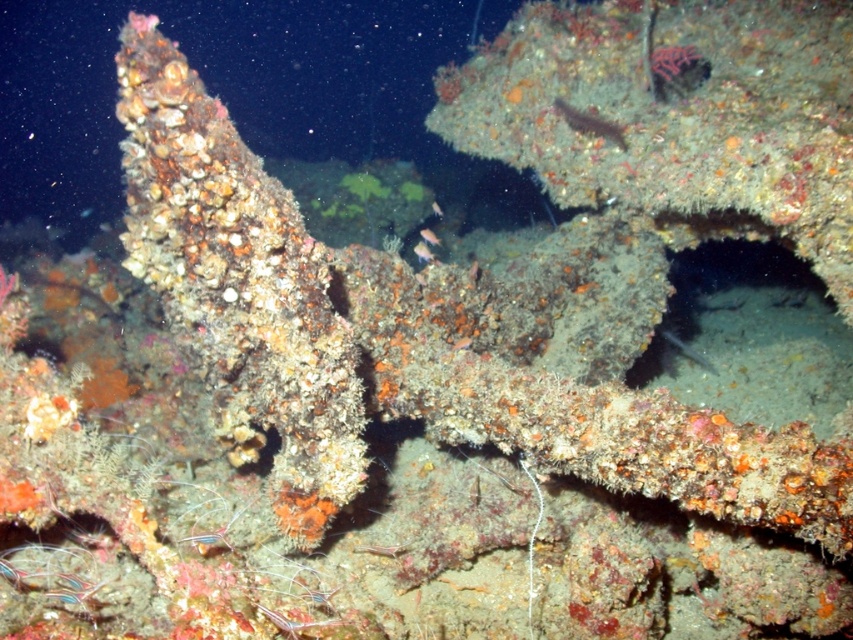
Can you confirm if smooth brown fish at center is taller than translucent green fish at center?

Yes.

Who is shorter, smooth brown fish at center or translucent green fish at center?

With less height is translucent green fish at center.

What do you see at coordinates (590, 122) in the screenshot?
I see `smooth brown fish at center` at bounding box center [590, 122].

Where is `smooth brown fish at center`? smooth brown fish at center is located at coordinates (590, 122).

Does orange coral-like at center appear on the right side of translucent green fish at center?

Correct, you'll find orange coral-like at center to the right of translucent green fish at center.

Between point (469, 346) and point (438, 205), which one is positioned in front?

Point (469, 346) is more forward.

Is point (469, 339) more distant than point (440, 216)?

No, (469, 339) is closer to viewer.

Identify the location of orange coral-like at center. This screenshot has height=640, width=853. (462, 342).

In the scene shown: Does smooth brown fish at center have a lesser height compared to silvery metallic fish at center?

No.

Which is more to the right, smooth brown fish at center or silvery metallic fish at center?

From the viewer's perspective, silvery metallic fish at center appears more on the right side.

The height and width of the screenshot is (640, 853). What do you see at coordinates (590, 122) in the screenshot? I see `smooth brown fish at center` at bounding box center [590, 122].

Where is `smooth brown fish at center`? This screenshot has width=853, height=640. smooth brown fish at center is located at coordinates (590, 122).